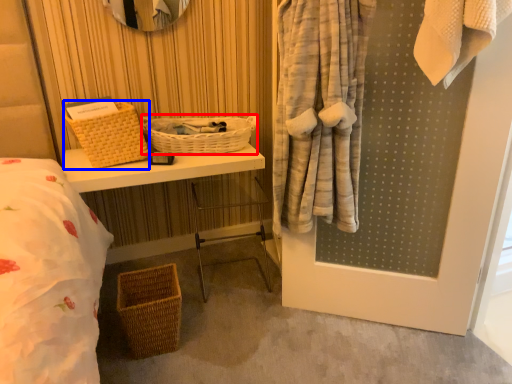
Question: Which of the following is the farthest to the observer, basket (highlighted by a red box) or basket (highlighted by a blue box)?

Choices:
 (A) basket
 (B) basket

Answer: (A)